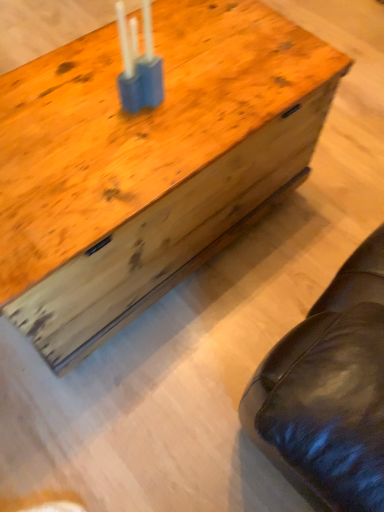
Where is `free point above wooden trunk at center (from a real-world perspective)`? free point above wooden trunk at center (from a real-world perspective) is located at coordinates (135, 106).